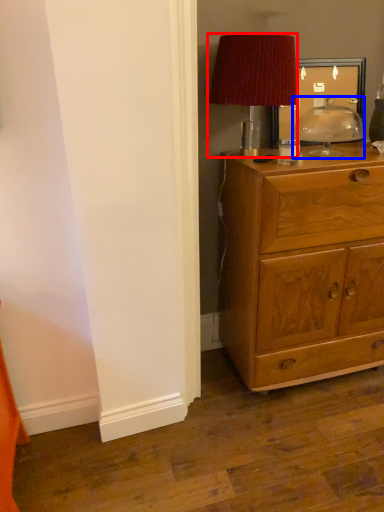
Question: Which object appears farthest to the camera in this image, lamp (highlighted by a red box) or table lamp (highlighted by a blue box)?

Choices:
 (A) lamp
 (B) table lamp

Answer: (B)